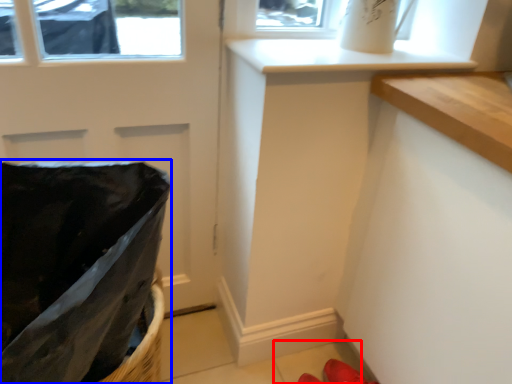
Question: Which of the following is the farthest to the observer, tile (highlighted by a red box) or laundry basket (highlighted by a blue box)?

Choices:
 (A) tile
 (B) laundry basket

Answer: (A)